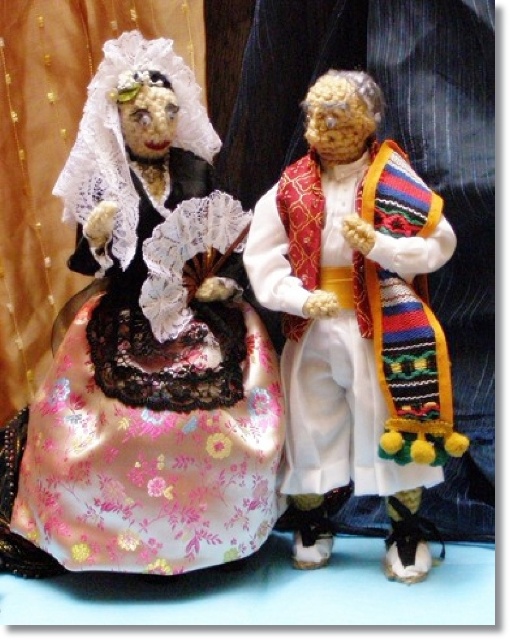
Question: Can you confirm if silky floral dress at left is thinner than white satin vest at center?

Choices:
 (A) yes
 (B) no

Answer: (B)

Question: Is silky floral dress at left smaller than white satin vest at center?

Choices:
 (A) yes
 (B) no

Answer: (B)

Question: Is silky floral dress at left bigger than white satin vest at center?

Choices:
 (A) no
 (B) yes

Answer: (B)

Question: Which point is closer to the camera?

Choices:
 (A) (394, 196)
 (B) (2, 458)

Answer: (A)

Question: Which point is closer to the camera?

Choices:
 (A) (132, 426)
 (B) (420, 472)

Answer: (A)